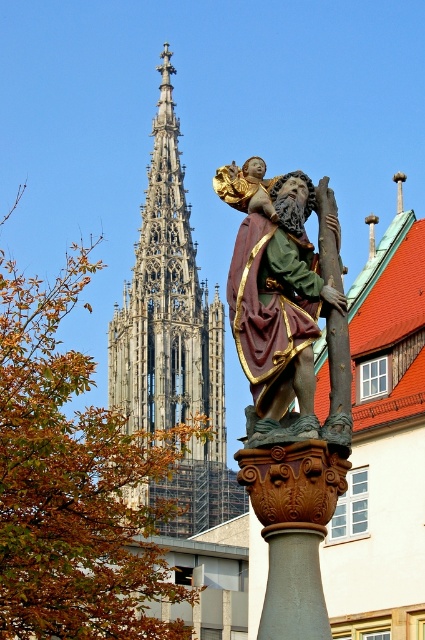
Between stone gothic spire at upper left and polychrome wood statue of saint christopher at center, which one has less height?

Standing shorter between the two is polychrome wood statue of saint christopher at center.

Locate an element on the screen. The height and width of the screenshot is (640, 425). stone gothic spire at upper left is located at coordinates (172, 339).

Identify the location of stone gothic spire at upper left. pyautogui.click(x=172, y=339).

Between polychrome wood statue of saint christopher at center and smooth gray stone pillar at center, which one is positioned higher?

Positioned higher is polychrome wood statue of saint christopher at center.

Who is positioned more to the left, polychrome wood statue of saint christopher at center or smooth gray stone pillar at center?

polychrome wood statue of saint christopher at center

The image size is (425, 640). What do you see at coordinates (274, 294) in the screenshot?
I see `polychrome wood statue of saint christopher at center` at bounding box center [274, 294].

Identify the location of polychrome wood statue of saint christopher at center. The width and height of the screenshot is (425, 640). (274, 294).

Between stone gothic spire at upper left and smooth gray stone pillar at center, which one has less height?

smooth gray stone pillar at center

Which is behind, point (144, 348) or point (319, 538)?

The point (144, 348) is behind.

Describe the element at coordinates (172, 339) in the screenshot. I see `stone gothic spire at upper left` at that location.

Image resolution: width=425 pixels, height=640 pixels. I want to click on stone gothic spire at upper left, so click(x=172, y=339).